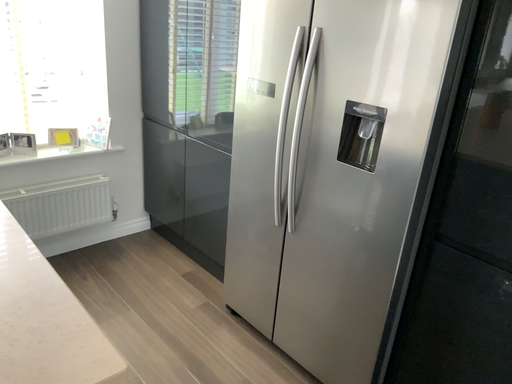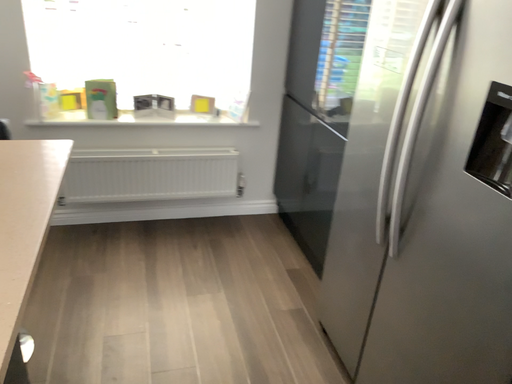
Question: How did the camera likely rotate when shooting the video?

Choices:
 (A) rotated left
 (B) rotated right

Answer: (A)